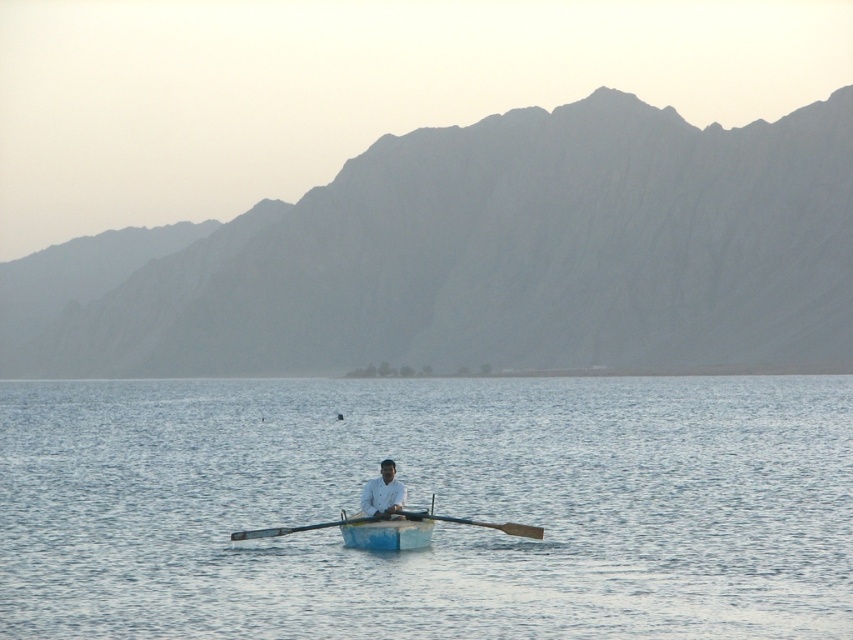
What is the exact coordinate of the blue water at center?

The blue water at center is located at point (427,506).

Looking at this image, you are standing on the blue painted wood canoe at center and want to reach the gray rock mountain at upper center. Given that your boat can travel at 2 meters per second, how many minutes will it take to reach the mountain?

The gray rock mountain at upper center is 256.63 meters away from the blue painted wood canoe at center. At a speed of 2 meters per second, it would take 256.63 divided by 2 equals 128.315 seconds. Converting seconds to minutes, 128.315 divided by 60 equals approximately 2.138 minutes. Therefore, it will take roughly 2.14 minutes to reach the mountain.